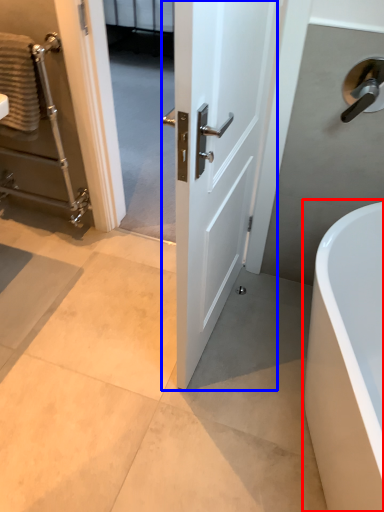
Question: Which object appears farthest to the camera in this image, bathtub (highlighted by a red box) or door (highlighted by a blue box)?

Choices:
 (A) bathtub
 (B) door

Answer: (A)